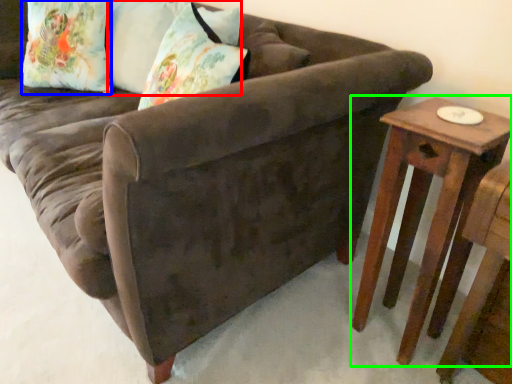
Question: Based on their relative distances, which object is farther from pillow (highlighted by a red box)? Choose from pillow (highlighted by a blue box) and table (highlighted by a green box).

Choices:
 (A) pillow
 (B) table

Answer: (B)